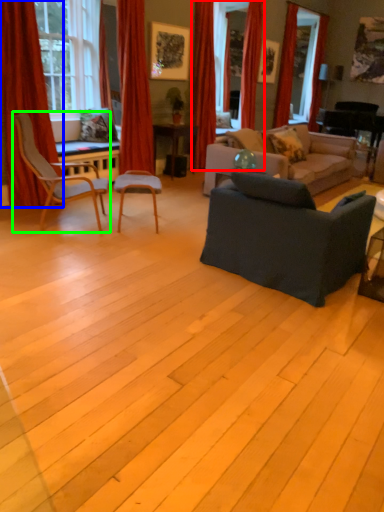
Question: Estimate the real-world distances between objects in this image. Which object is closer to curtain (highlighted by a red box), curtain (highlighted by a blue box) or chair (highlighted by a green box)?

Choices:
 (A) curtain
 (B) chair

Answer: (B)